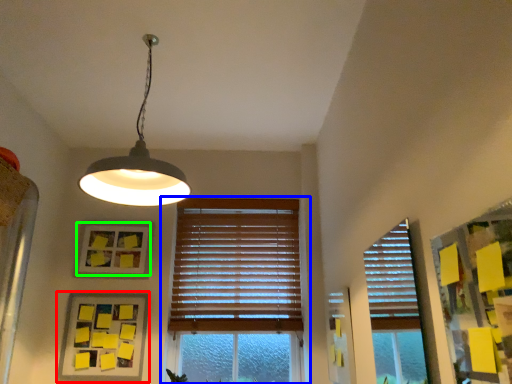
Question: Based on their relative distances, which object is nearer to picture frame (highlighted by a red box)? Choose from window (highlighted by a blue box) and picture frame (highlighted by a green box).

Choices:
 (A) window
 (B) picture frame

Answer: (B)